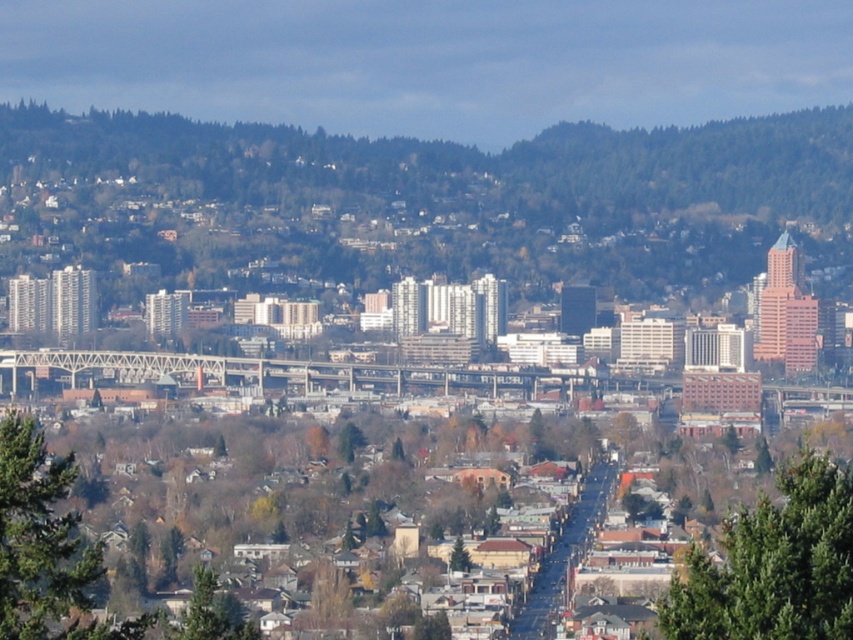
You are standing in the cityscape and want to take a photo of both the green textured tree at lower right and the green leafy tree at lower left. Which tree should you focus on first to ensure both are in the frame?

You should focus on the green textured tree at lower right first because it is closer to you than the green leafy tree at lower left, so adjusting the camera to include both would require framing from the closer one outward.

You are a drone operator trying to navigate a delivery drone through the city. The drone must avoid the green forested mountain at center. What coordinates should the drone avoid to ensure safe passage?

The green forested mountain at center is located at coordinates (422, 204), so the drone should avoid this point to ensure safe passage.